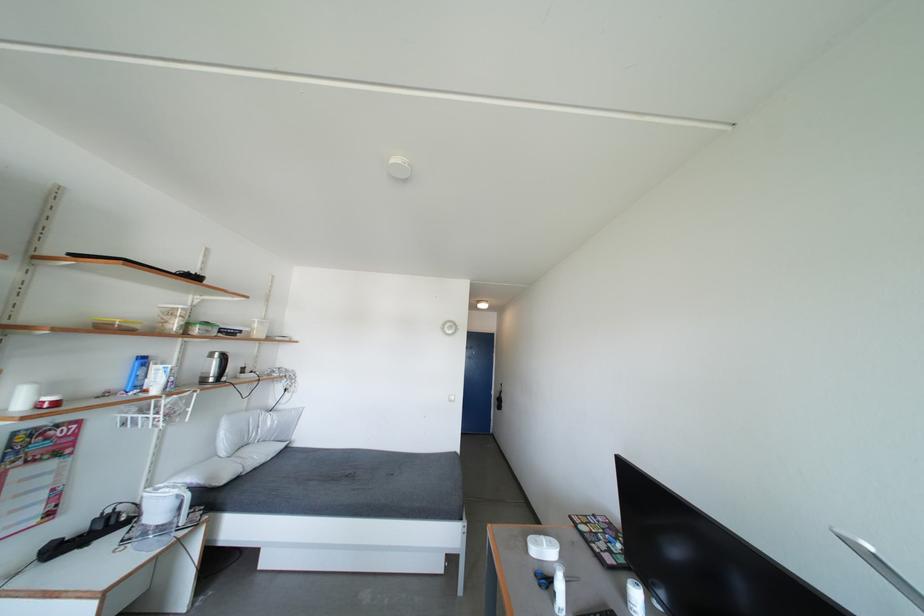
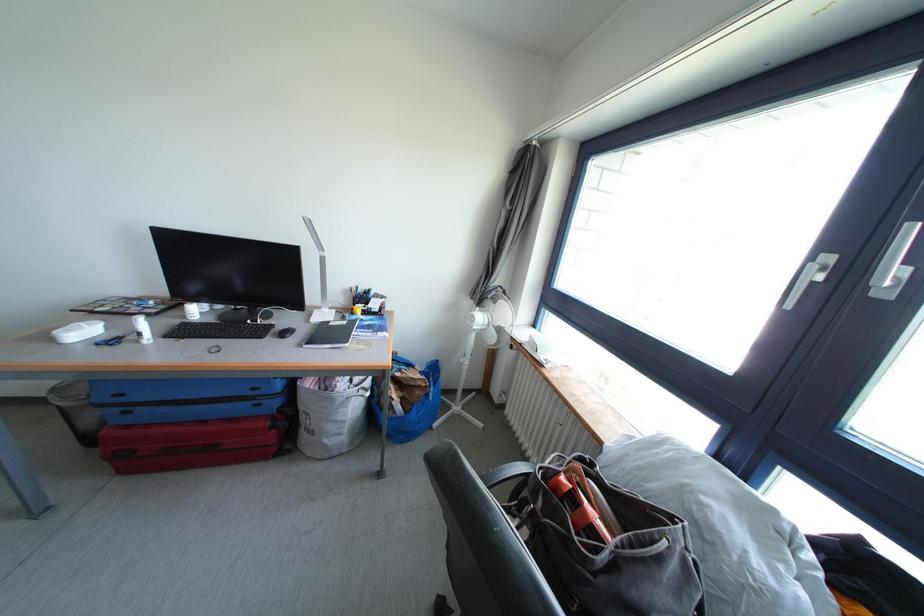
The point at (542,546) is marked in the first image. Where is the corresponding point in the second image?

(78, 336)